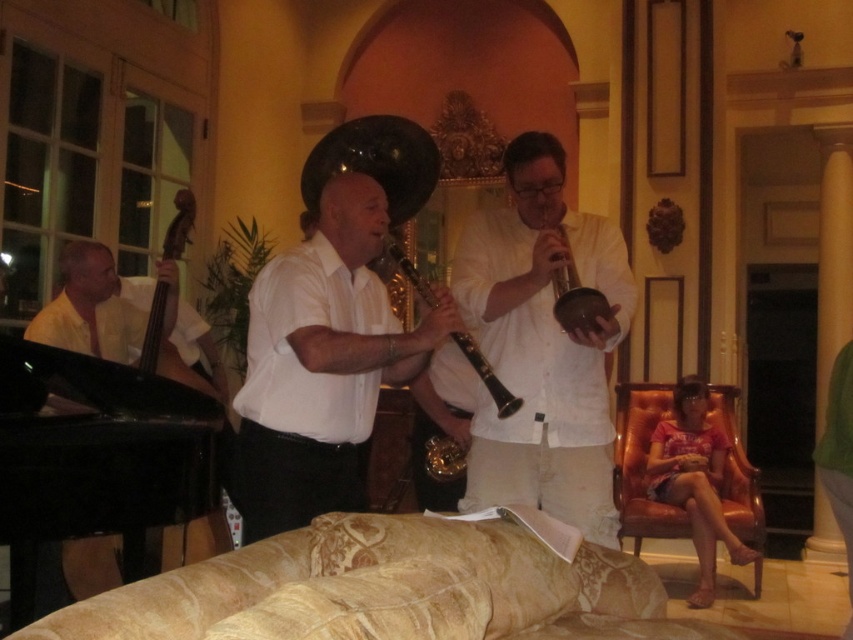
Between point (459, 296) and point (569, 284), which one is positioned in front?

Point (569, 284) is in front.

Between white linen shirt at center and metallic gold trumpet at center, which one has more height?

Standing taller between the two is white linen shirt at center.

The height and width of the screenshot is (640, 853). Identify the location of white linen shirt at center. (543, 346).

Is gold-patterned fabric couch at lower center above matte black hautboy at lower right?

Yes, gold-patterned fabric couch at lower center is above matte black hautboy at lower right.

In the scene shown: Does gold-patterned fabric couch at lower center have a larger size compared to matte black hautboy at lower right?

No, gold-patterned fabric couch at lower center is not bigger than matte black hautboy at lower right.

Which is in front, point (560, 596) or point (723, 440)?

Positioned in front is point (560, 596).

I want to click on gold-patterned fabric couch at lower center, so click(387, 589).

Which of these two, matte black hautboy at lower right or black matte clarinet at center, stands taller?

matte black hautboy at lower right is taller.

Is matte black hautboy at lower right shorter than black matte clarinet at center?

Incorrect, matte black hautboy at lower right's height does not fall short of black matte clarinet at center's.

Is point (706, 451) positioned after point (490, 385)?

That is True.

Identify the location of matte black hautboy at lower right. 694,481.